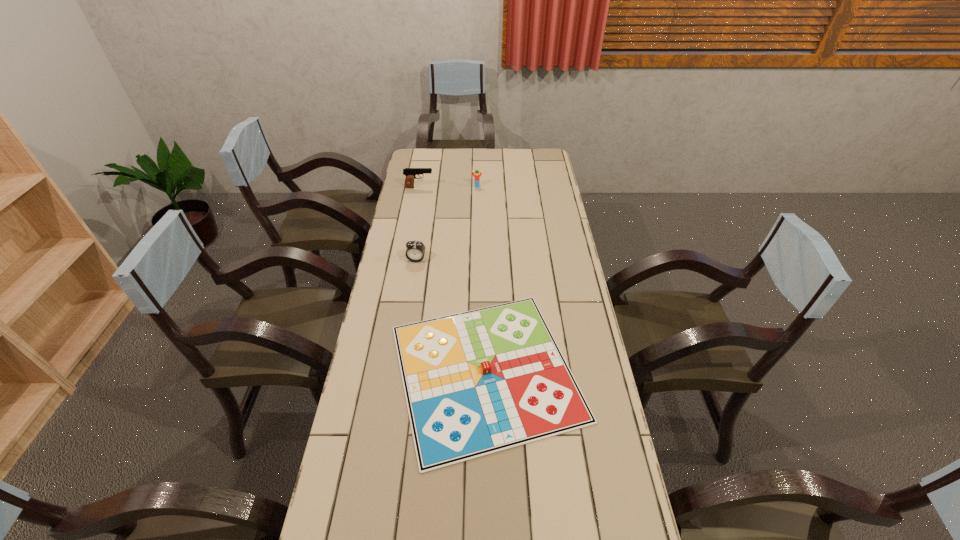
At what (x,y) coordinates should I click in order to perform the action: click on alarm clock that is at the left edge. Please return your answer as a coordinate pair (x, y). This screenshot has width=960, height=540. Looking at the image, I should click on (415, 251).

At what (x,y) coordinates should I click in order to perform the action: click on gameboard present at the left edge. Please return your answer as a coordinate pair (x, y). The width and height of the screenshot is (960, 540). Looking at the image, I should click on (478, 382).

The height and width of the screenshot is (540, 960). I want to click on object that is at the right edge, so click(478, 382).

At what (x,y) coordinates should I click in order to perform the action: click on vacant point at the far edge. Please return your answer as a coordinate pair (x, y). The width and height of the screenshot is (960, 540). Looking at the image, I should click on (466, 172).

Image resolution: width=960 pixels, height=540 pixels. In the image, there is a desktop. Find the location of `vacant region at the left edge`. vacant region at the left edge is located at coordinates (432, 177).

Locate an element on the screen. vacant region at the right edge of the desktop is located at coordinates (549, 179).

Identify the location of vacant space at the far left corner. (439, 152).

At what (x,y) coordinates should I click in order to perform the action: click on free point between the Lego and the tallest object. Please return your answer as a coordinate pair (x, y). The image size is (960, 540). Looking at the image, I should click on (448, 187).

At what (x,y) coordinates should I click in order to perform the action: click on free spot between the nearest object and the pistol. Please return your answer as a coordinate pair (x, y). Looking at the image, I should click on (452, 280).

Identify the location of blank region between the nearest object and the Lego. This screenshot has width=960, height=540. click(x=481, y=279).